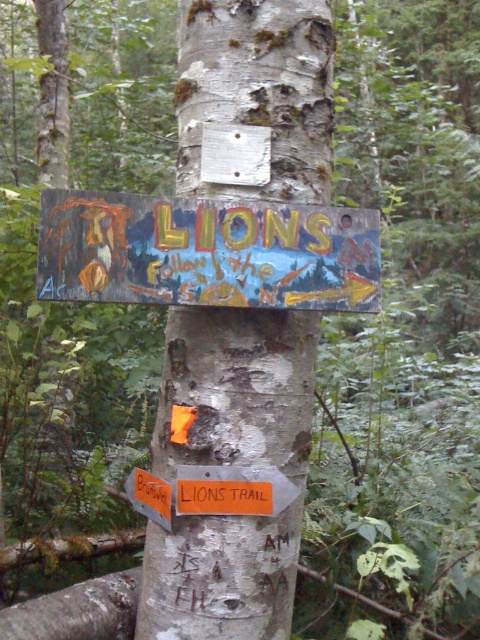
Question: Does wooden painted signboard at center have a larger size compared to white rough bark at center?

Choices:
 (A) yes
 (B) no

Answer: (B)

Question: Among these objects, which one is farthest from the camera?

Choices:
 (A) white rough bark at center
 (B) wooden painted signboard at center

Answer: (A)

Question: Which of the following is the farthest from the observer?

Choices:
 (A) white rough bark at center
 (B) wooden painted signboard at center

Answer: (A)

Question: Is wooden painted signboard at center closer to camera compared to white rough bark at center?

Choices:
 (A) no
 (B) yes

Answer: (B)

Question: Does wooden painted signboard at center appear on the left side of white rough bark at center?

Choices:
 (A) yes
 (B) no

Answer: (A)